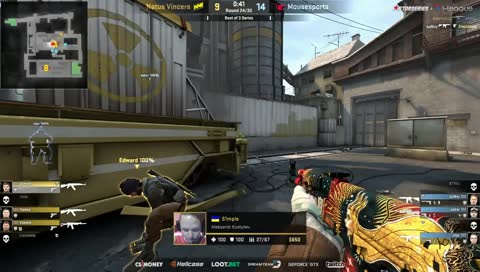
The height and width of the screenshot is (272, 480). In order to click on map in this screenshot , I will do `click(52, 70)`.